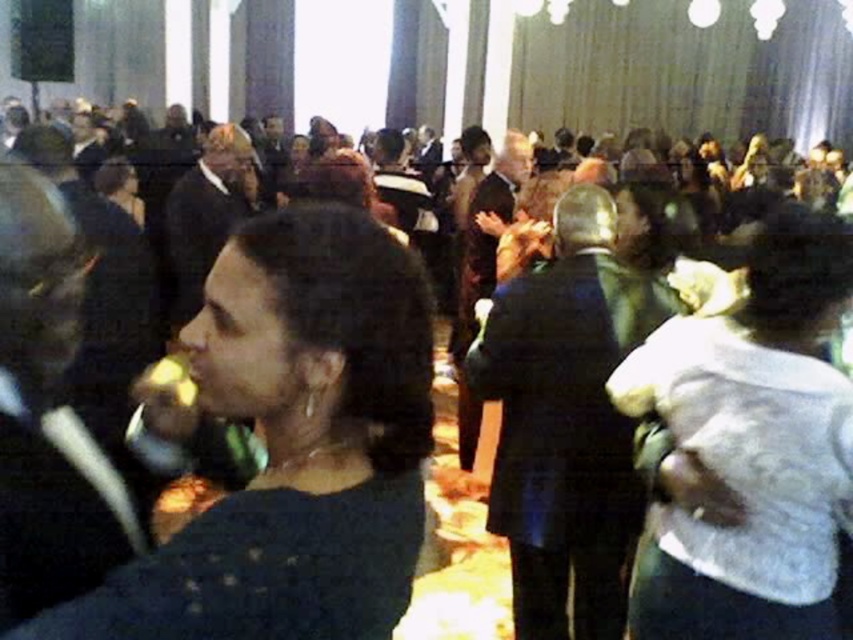
Question: Does dark blue sweater at center have a larger size compared to white fabric purse at center?

Choices:
 (A) no
 (B) yes

Answer: (A)

Question: Can you confirm if dark blue sweater at center is positioned below white fabric purse at center?

Choices:
 (A) no
 (B) yes

Answer: (A)

Question: Does dark blue sweater at center appear under white fabric purse at center?

Choices:
 (A) no
 (B) yes

Answer: (A)